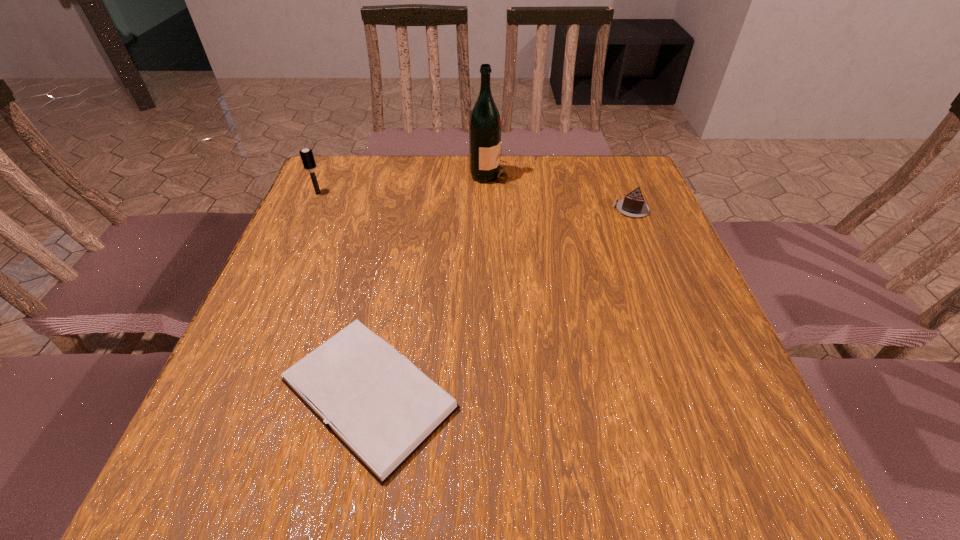
What are the coordinates of `free point that satisfies the following two spatial constraints: 1. on the front side of the second farthest object; 2. on the left side of the second object from left to right` in the screenshot? It's located at (228, 394).

Identify the location of vacant space that satisfies the following two spatial constraints: 1. on the back side of the nearest object; 2. on the left side of the wine bottle. (413, 174).

Where is `free space that satisfies the following two spatial constraints: 1. on the back side of the third shortest object; 2. on the right side of the third object from left to right`? free space that satisfies the following two spatial constraints: 1. on the back side of the third shortest object; 2. on the right side of the third object from left to right is located at coordinates (326, 174).

Locate an element on the screen. The image size is (960, 540). free region that satisfies the following two spatial constraints: 1. on the front side of the second object from left to right; 2. on the left side of the third nearest object is located at coordinates (228, 394).